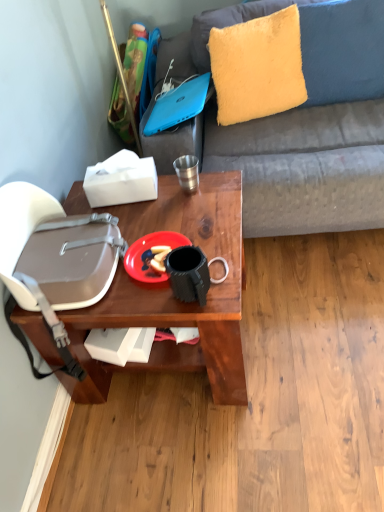
The height and width of the screenshot is (512, 384). What are the coordinates of `empty space that is in between plastic matte plate at center and metallic silver cup at center` in the screenshot? It's located at (168, 212).